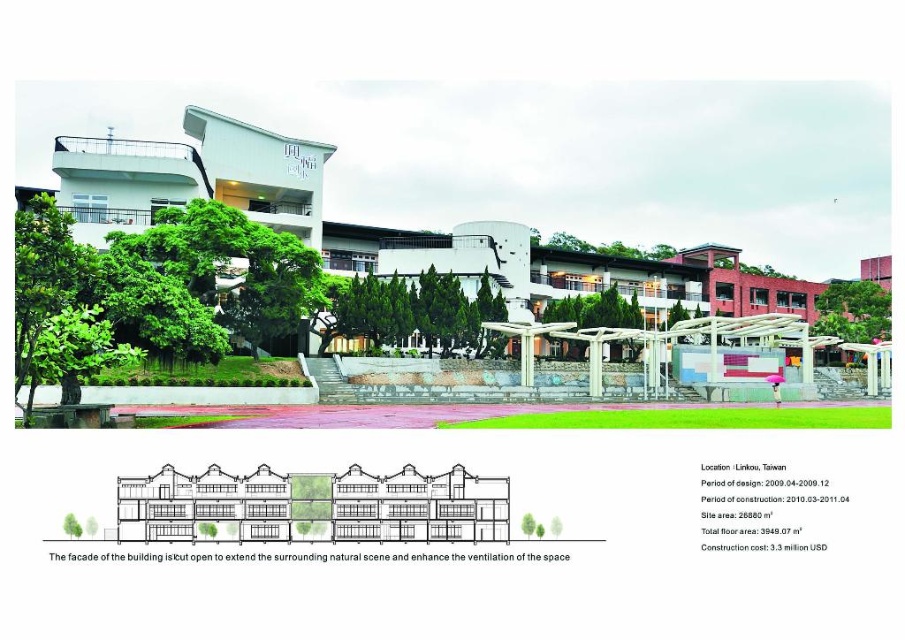
You are standing in front of the building and want to walk from the paved walkway to the covered outdoor seating area. There are two trees in the center, a green textured tree at center and a green leafy tree at center. Which tree should you walk around to reach the seating area without crossing between them?

You should walk around the green leafy tree at center because the green textured tree at center is positioned on its left side, so going around the right side of the green leafy tree at center would avoid crossing between them.

You are standing at the entrance of the building in Linkou, Taiwan. You see a point marked at coordinates (x=411, y=308). What object is located at that point?

The point at coordinates (x=411, y=308) indicates a green textured tree at center.